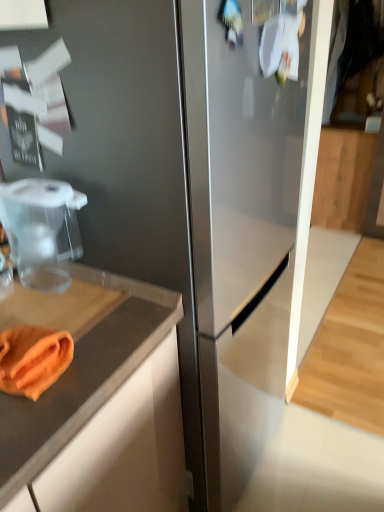
Question: Can you confirm if wooden cabinet at right is bigger than transparent plastic food processor at left?

Choices:
 (A) no
 (B) yes

Answer: (B)

Question: From the image's perspective, is wooden cabinet at right beneath transparent plastic food processor at left?

Choices:
 (A) no
 (B) yes

Answer: (A)

Question: Is wooden cabinet at right closer to camera compared to transparent plastic food processor at left?

Choices:
 (A) no
 (B) yes

Answer: (A)

Question: From a real-world perspective, is wooden cabinet at right under transparent plastic food processor at left?

Choices:
 (A) no
 (B) yes

Answer: (B)

Question: Can you confirm if wooden cabinet at right is smaller than transparent plastic food processor at left?

Choices:
 (A) no
 (B) yes

Answer: (A)

Question: Based on their sizes in the image, would you say transparent plastic food processor at left is bigger or smaller than wooden cabinet at right?

Choices:
 (A) small
 (B) big

Answer: (A)

Question: In the image, is transparent plastic food processor at left positioned in front of or behind wooden cabinet at right?

Choices:
 (A) front
 (B) behind

Answer: (A)

Question: From the image's perspective, is transparent plastic food processor at left above or below wooden cabinet at right?

Choices:
 (A) below
 (B) above

Answer: (A)

Question: Does point [1, 190] appear closer or farther from the camera than point [337, 140]?

Choices:
 (A) farther
 (B) closer

Answer: (B)

Question: Is point (1, 339) positioned closer to the camera than point (337, 162)?

Choices:
 (A) farther
 (B) closer

Answer: (B)

Question: From a real-world perspective, is orange cloth at lower left above or below wooden cabinet at right?

Choices:
 (A) above
 (B) below

Answer: (A)

Question: Would you say orange cloth at lower left is inside or outside wooden cabinet at right?

Choices:
 (A) inside
 (B) outside

Answer: (B)

Question: In the image, is orange cloth at lower left positioned in front of or behind wooden cabinet at right?

Choices:
 (A) behind
 (B) front

Answer: (B)

Question: From a real-world perspective, is wooden cabinet at right positioned above or below orange cloth at lower left?

Choices:
 (A) above
 (B) below

Answer: (B)

Question: Is point (319, 187) closer or farther from the camera than point (44, 360)?

Choices:
 (A) farther
 (B) closer

Answer: (A)